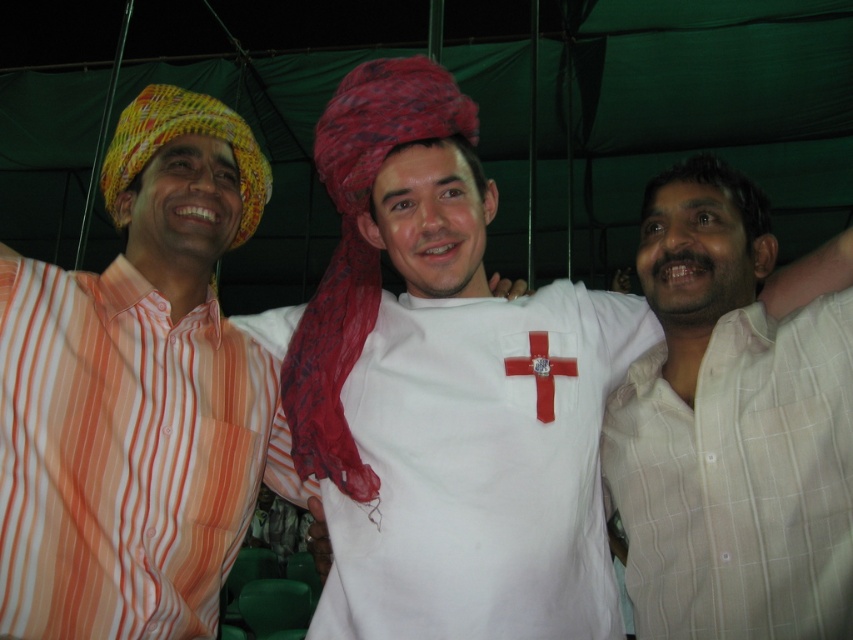
Question: Considering the real-world distances, which object is farthest from the red fabric headscarf at center?

Choices:
 (A) white checkered shirt at right
 (B) orange striped shirt at left
 (C) white matte shirt at center

Answer: (A)

Question: Is orange striped shirt at left further to camera compared to yellow woven hat at left?

Choices:
 (A) no
 (B) yes

Answer: (A)

Question: Which of the following is the closest to the observer?

Choices:
 (A) yellow woven hat at left
 (B) orange striped shirt at left
 (C) red matte cross at center

Answer: (B)

Question: Which point is closer to the camera?

Choices:
 (A) red matte cross at center
 (B) red fabric headscarf at center

Answer: (B)

Question: Does red fabric headscarf at center appear on the left side of yellow woven hat at left?

Choices:
 (A) no
 (B) yes

Answer: (A)

Question: Where is white checkered shirt at right located in relation to yellow woven hat at left in the image?

Choices:
 (A) below
 (B) above

Answer: (A)